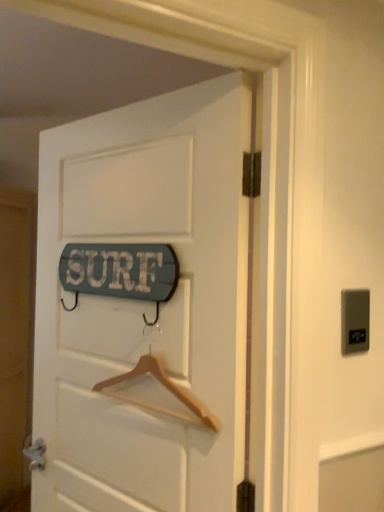
Question: Is gray plastic electric outlet at upper right to the right of wooden signboard at center from the viewer's perspective?

Choices:
 (A) yes
 (B) no

Answer: (A)

Question: Is gray plastic electric outlet at upper right directly adjacent to wooden signboard at center?

Choices:
 (A) yes
 (B) no

Answer: (B)

Question: Can you confirm if gray plastic electric outlet at upper right is shorter than wooden signboard at center?

Choices:
 (A) no
 (B) yes

Answer: (B)

Question: Does gray plastic electric outlet at upper right appear on the left side of wooden signboard at center?

Choices:
 (A) no
 (B) yes

Answer: (A)

Question: Is gray plastic electric outlet at upper right positioned before wooden signboard at center?

Choices:
 (A) yes
 (B) no

Answer: (B)

Question: From the image's perspective, is gray plastic electric outlet at upper right located above or below wooden signboard at center?

Choices:
 (A) above
 (B) below

Answer: (A)

Question: In terms of width, does gray plastic electric outlet at upper right look wider or thinner when compared to wooden signboard at center?

Choices:
 (A) wide
 (B) thin

Answer: (B)

Question: Is gray plastic electric outlet at upper right taller or shorter than wooden signboard at center?

Choices:
 (A) short
 (B) tall

Answer: (A)

Question: Does point (365, 315) appear closer or farther from the camera than point (168, 306)?

Choices:
 (A) farther
 (B) closer

Answer: (B)

Question: From a real-world perspective, is wooden hanger at center above or below wooden signboard at center?

Choices:
 (A) above
 (B) below

Answer: (B)

Question: Relative to wooden signboard at center, is wooden hanger at center in front or behind?

Choices:
 (A) behind
 (B) front

Answer: (A)

Question: Considering the positions of wooden hanger at center and wooden signboard at center in the image, is wooden hanger at center wider or thinner than wooden signboard at center?

Choices:
 (A) thin
 (B) wide

Answer: (A)

Question: Does point (96, 385) appear closer or farther from the camera than point (84, 206)?

Choices:
 (A) farther
 (B) closer

Answer: (B)

Question: In terms of height, does wooden signboard at center look taller or shorter compared to gray plastic electric outlet at upper right?

Choices:
 (A) tall
 (B) short

Answer: (A)

Question: Looking at their shapes, would you say wooden signboard at center is wider or thinner than gray plastic electric outlet at upper right?

Choices:
 (A) thin
 (B) wide

Answer: (B)